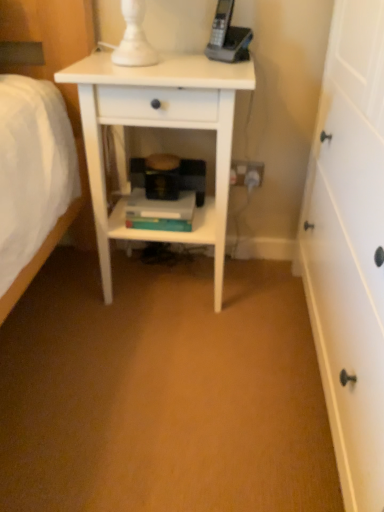
Question: Does white plastic electrical outlet at lower center appear on the right side of white matte nightstand at center?

Choices:
 (A) yes
 (B) no

Answer: (A)

Question: From the image's perspective, is white plastic electrical outlet at lower center located beneath white matte nightstand at center?

Choices:
 (A) no
 (B) yes

Answer: (A)

Question: Considering the relative sizes of white plastic electrical outlet at lower center and white matte nightstand at center in the image provided, is white plastic electrical outlet at lower center thinner than white matte nightstand at center?

Choices:
 (A) no
 (B) yes

Answer: (B)

Question: Does white plastic electrical outlet at lower center have a lesser height compared to white matte nightstand at center?

Choices:
 (A) no
 (B) yes

Answer: (B)

Question: Is white plastic electrical outlet at lower center facing away from white matte nightstand at center?

Choices:
 (A) yes
 (B) no

Answer: (B)

Question: Can we say white plastic electrical outlet at lower center lies outside white matte nightstand at center?

Choices:
 (A) yes
 (B) no

Answer: (A)

Question: From the image's perspective, is hardcover books at center under white matte nightstand at center?

Choices:
 (A) no
 (B) yes

Answer: (B)

Question: From a real-world perspective, is hardcover books at center physically above white matte nightstand at center?

Choices:
 (A) no
 (B) yes

Answer: (A)

Question: Is hardcover books at center next to white matte nightstand at center and touching it?

Choices:
 (A) yes
 (B) no

Answer: (B)

Question: Is hardcover books at center to the right of white matte nightstand at center from the viewer's perspective?

Choices:
 (A) yes
 (B) no

Answer: (B)

Question: Is hardcover books at center shorter than white matte nightstand at center?

Choices:
 (A) no
 (B) yes

Answer: (B)

Question: From the image's perspective, is hardcover books at center above white matte nightstand at center?

Choices:
 (A) yes
 (B) no

Answer: (B)

Question: From the image's perspective, does white plastic electrical outlet at lower center appear higher than hardcover books at center?

Choices:
 (A) no
 (B) yes

Answer: (B)